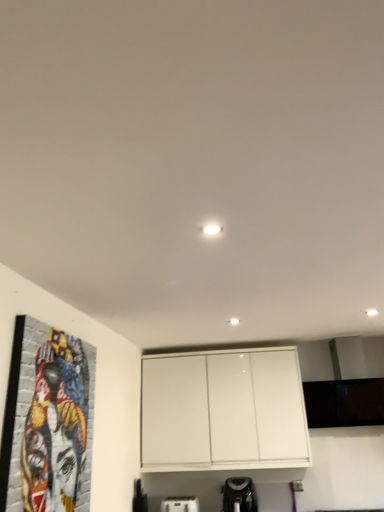
Question: Would you consider black plastic coffee maker at lower center, marked as the first appliance in a right-to-left arrangement, to be distant from white plastic toaster at lower center, the first appliance when ordered from left to right?

Choices:
 (A) no
 (B) yes

Answer: (A)

Question: Is the depth of black plastic coffee maker at lower center, marked as the first appliance in a right-to-left arrangement, greater than that of white plastic toaster at lower center, the first appliance when ordered from left to right?

Choices:
 (A) yes
 (B) no

Answer: (B)

Question: Is black plastic coffee maker at lower center, the second appliance viewed from the left, shorter than white plastic toaster at lower center, the second appliance viewed from the right?

Choices:
 (A) no
 (B) yes

Answer: (A)

Question: Is black plastic coffee maker at lower center, marked as the first appliance in a right-to-left arrangement, not within white plastic toaster at lower center, the second appliance viewed from the right?

Choices:
 (A) no
 (B) yes

Answer: (B)

Question: Does black plastic coffee maker at lower center, the second appliance viewed from the left, have a greater height compared to white plastic toaster at lower center, the first appliance when ordered from left to right?

Choices:
 (A) no
 (B) yes

Answer: (B)

Question: Considering their positions, is black plastic coffee maker at lower center, marked as the first appliance in a right-to-left arrangement, located in front of or behind white plastic toaster at lower center, the first appliance when ordered from left to right?

Choices:
 (A) behind
 (B) front

Answer: (B)

Question: Looking at the image, does black plastic coffee maker at lower center, marked as the first appliance in a right-to-left arrangement, seem bigger or smaller compared to white plastic toaster at lower center, the second appliance viewed from the right?

Choices:
 (A) small
 (B) big

Answer: (B)

Question: Considering the relative positions of black plastic coffee maker at lower center, marked as the first appliance in a right-to-left arrangement, and white plastic toaster at lower center, the first appliance when ordered from left to right, in the image provided, is black plastic coffee maker at lower center, marked as the first appliance in a right-to-left arrangement, to the left or to the right of white plastic toaster at lower center, the first appliance when ordered from left to right,?

Choices:
 (A) right
 (B) left

Answer: (A)

Question: Is black plastic coffee maker at lower center, marked as the first appliance in a right-to-left arrangement, inside the boundaries of white plastic toaster at lower center, the first appliance when ordered from left to right, or outside?

Choices:
 (A) inside
 (B) outside

Answer: (B)

Question: Is colorful mosaic portrait at left in front of or behind black plastic coffee maker at lower center, marked as the first appliance in a right-to-left arrangement, in the image?

Choices:
 (A) behind
 (B) front

Answer: (B)

Question: From the image's perspective, is colorful mosaic portrait at left located above or below black plastic coffee maker at lower center, marked as the first appliance in a right-to-left arrangement?

Choices:
 (A) below
 (B) above

Answer: (B)

Question: Is colorful mosaic portrait at left inside or outside of black plastic coffee maker at lower center, marked as the first appliance in a right-to-left arrangement?

Choices:
 (A) inside
 (B) outside

Answer: (B)

Question: Is colorful mosaic portrait at left to the left or to the right of black plastic coffee maker at lower center, marked as the first appliance in a right-to-left arrangement, in the image?

Choices:
 (A) left
 (B) right

Answer: (A)

Question: Would you say white plastic toaster at lower center, the second appliance viewed from the right, is to the left or to the right of black plastic coffee maker at lower center, the second appliance viewed from the left, in the picture?

Choices:
 (A) right
 (B) left

Answer: (B)

Question: From the image's perspective, relative to black plastic coffee maker at lower center, the second appliance viewed from the left, is white plastic toaster at lower center, the first appliance when ordered from left to right, above or below?

Choices:
 (A) below
 (B) above

Answer: (A)